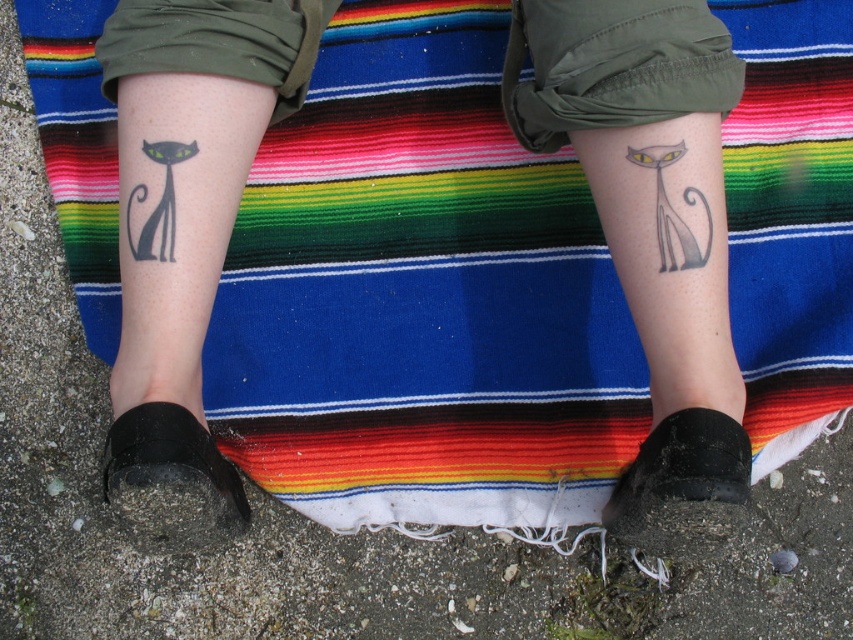
Question: Which point appears closest to the camera in this image?

Choices:
 (A) (221, 241)
 (B) (128, 209)
 (C) (660, 172)
 (D) (688, 125)

Answer: (D)

Question: Is black matte tattoo at lower left bigger than black matte cat at left?

Choices:
 (A) no
 (B) yes

Answer: (B)

Question: Does gray ink cat tattoo at lower center come behind black ink cat at right?

Choices:
 (A) no
 (B) yes

Answer: (A)

Question: Is black matte tattoo at lower left above black ink cat at right?

Choices:
 (A) no
 (B) yes

Answer: (A)

Question: Which point is farther to the camera?

Choices:
 (A) black matte cat at left
 (B) black matte tattoo at lower left

Answer: (A)

Question: Which point is farther to the camera?

Choices:
 (A) black ink cat at right
 (B) gray ink cat tattoo at lower center
 (C) black matte cat at left

Answer: (C)